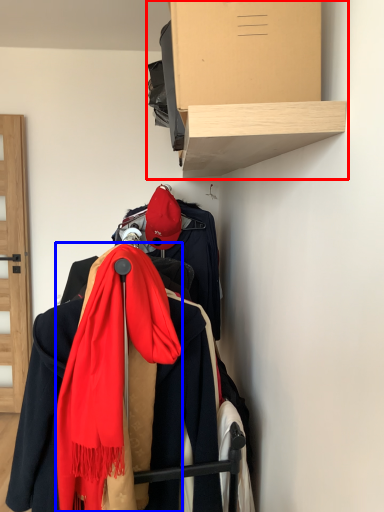
Question: Which object appears closest to the camera in this image, shelf (highlighted by a red box) or scarf (highlighted by a blue box)?

Choices:
 (A) shelf
 (B) scarf

Answer: (A)